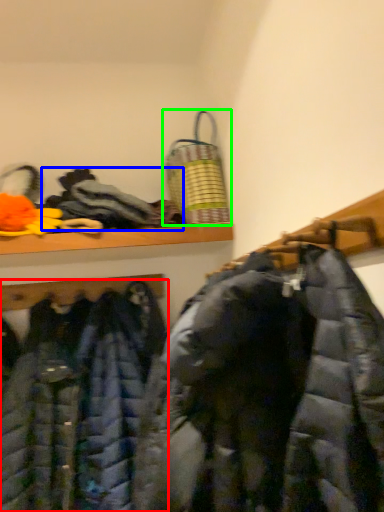
Question: Which is nearer to the jacket (highlighted by a red box)? cloak (highlighted by a blue box) or laundry basket (highlighted by a green box).

Choices:
 (A) cloak
 (B) laundry basket

Answer: (A)